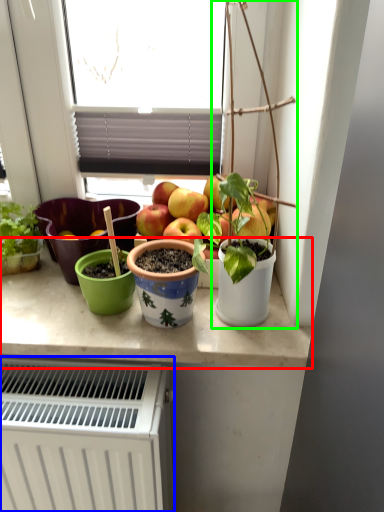
Question: Estimate the real-world distances between objects in this image. Which object is closer to counter top (highlighted by a red box), radiator (highlighted by a blue box) or houseplant (highlighted by a green box)?

Choices:
 (A) radiator
 (B) houseplant

Answer: (A)